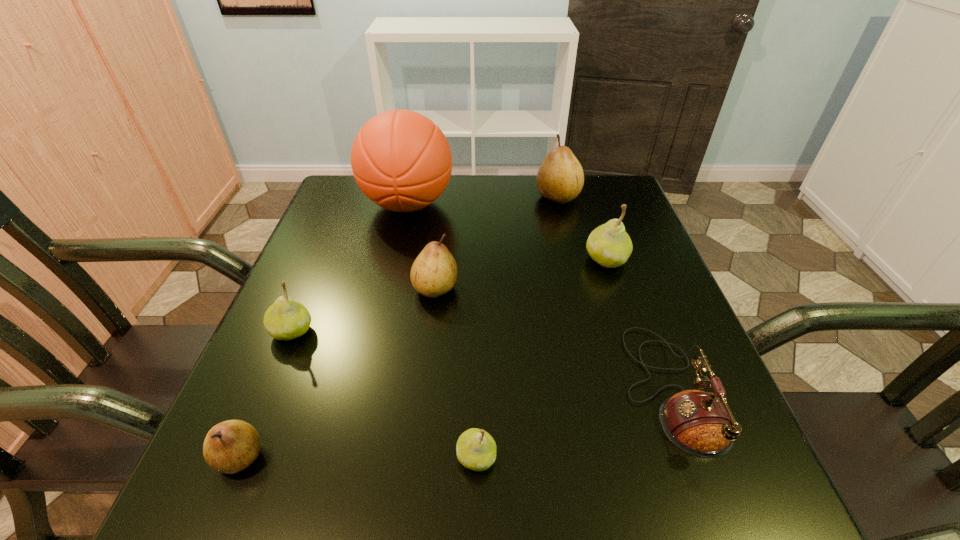
Locate an element on the screen. The height and width of the screenshot is (540, 960). free space between the second biggest brown pear and the leftmost brown pear is located at coordinates coord(338,372).

Find the location of `blank region between the biggest green pear and the tallest object`. blank region between the biggest green pear and the tallest object is located at coordinates (507, 232).

Locate an element on the screen. vacant region between the rightmost green pear and the second smallest green pear is located at coordinates pos(449,296).

Identify the location of free space that is in between the rightmost brown pear and the telephone. (614, 293).

Where is `vacant point located between the tallest object and the second smallest brown pear`? vacant point located between the tallest object and the second smallest brown pear is located at coordinates (421, 246).

Where is `blank region between the orange basketball and the fourth object from right to left`? This screenshot has width=960, height=540. blank region between the orange basketball and the fourth object from right to left is located at coordinates (442, 330).

You are a GUI agent. You are given a task and a screenshot of the screen. Output one action in this format:
    pyautogui.click(x=<x>, y=<y>)
    Task: Click on the empty space between the biggest green pear and the tallest object
    The height and width of the screenshot is (540, 960).
    Given the screenshot: What is the action you would take?
    pyautogui.click(x=507, y=232)

Identify the location of free space between the basketball and the pink telephone. (539, 297).

Locate an element on the screen. Image resolution: width=960 pixels, height=540 pixels. vacant area that lies between the basketball and the pink telephone is located at coordinates (539, 297).

This screenshot has width=960, height=540. I want to click on unoccupied position between the biggest brown pear and the second farthest brown pear, so click(496, 242).